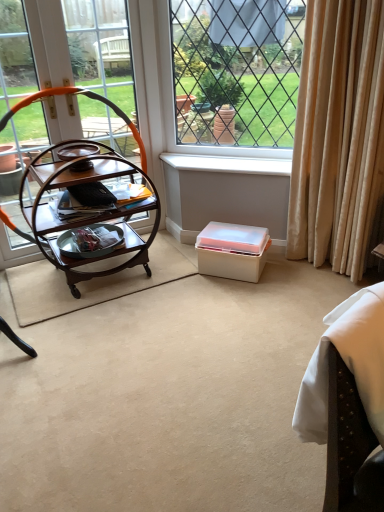
Question: Is the surface of wooden trolley at left in direct contact with white fabric swivel chair at lower right?

Choices:
 (A) yes
 (B) no

Answer: (B)

Question: Can we say wooden trolley at left lies outside white fabric swivel chair at lower right?

Choices:
 (A) yes
 (B) no

Answer: (A)

Question: Does wooden trolley at left have a smaller size compared to white fabric swivel chair at lower right?

Choices:
 (A) yes
 (B) no

Answer: (B)

Question: From the image's perspective, is wooden trolley at left below white fabric swivel chair at lower right?

Choices:
 (A) no
 (B) yes

Answer: (A)

Question: From a real-world perspective, is wooden trolley at left positioned under white fabric swivel chair at lower right based on gravity?

Choices:
 (A) yes
 (B) no

Answer: (A)

Question: From a real-world perspective, is white plastic box at center positioned above or below white plastic window sill at center?

Choices:
 (A) above
 (B) below

Answer: (B)

Question: Considering their positions, is white plastic box at center located in front of or behind white plastic window sill at center?

Choices:
 (A) front
 (B) behind

Answer: (A)

Question: Is white plastic box at center spatially inside white plastic window sill at center, or outside of it?

Choices:
 (A) inside
 (B) outside

Answer: (B)

Question: Is white plastic box at center bigger or smaller than white plastic window sill at center?

Choices:
 (A) big
 (B) small

Answer: (A)

Question: Considering the positions of white fabric swivel chair at lower right and white plastic box at center in the image, is white fabric swivel chair at lower right wider or thinner than white plastic box at center?

Choices:
 (A) wide
 (B) thin

Answer: (B)

Question: Would you say white fabric swivel chair at lower right is to the left or to the right of white plastic box at center in the picture?

Choices:
 (A) right
 (B) left

Answer: (A)

Question: From a real-world perspective, is white fabric swivel chair at lower right above or below white plastic box at center?

Choices:
 (A) above
 (B) below

Answer: (A)

Question: Would you say white fabric swivel chair at lower right is inside or outside white plastic box at center?

Choices:
 (A) outside
 (B) inside

Answer: (A)

Question: From a real-world perspective, relative to beige velvet curtain at right, is metallic silver tray at center vertically above or below?

Choices:
 (A) below
 (B) above

Answer: (A)

Question: Is metallic silver tray at center in front of or behind beige velvet curtain at right in the image?

Choices:
 (A) behind
 (B) front

Answer: (A)